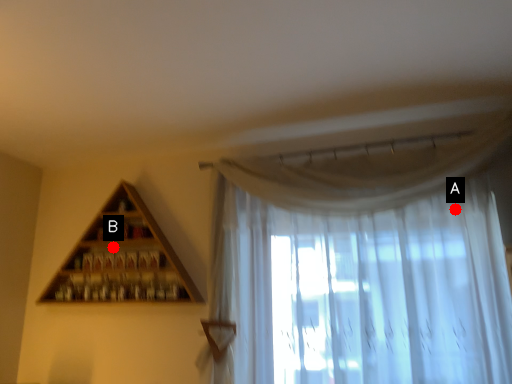
Question: Two points are circled on the image, labeled by A and B beside each circle. Which point is closer to the camera?

Choices:
 (A) A is closer
 (B) B is closer

Answer: (A)